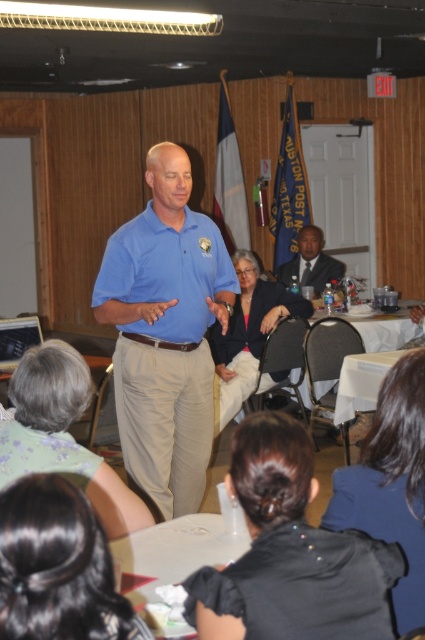
Which of these two, matte blue shirt at center or dark gray suit at center, stands shorter?

Standing shorter between the two is dark gray suit at center.

Does matte blue shirt at center have a greater height compared to dark gray suit at center?

Yes.

Identify the location of matte blue shirt at center. Image resolution: width=425 pixels, height=640 pixels. (166, 333).

Does matte blue shirt at center have a lesser width compared to white plastic table at lower center?

No, matte blue shirt at center is not thinner than white plastic table at lower center.

Is matte blue shirt at center in front of white plastic table at lower center?

No.

Where is `matte blue shirt at center`? matte blue shirt at center is located at coordinates (166, 333).

Measure the distance between white plastic table at lower center and dark gray suit at center.

They are 15.45 feet apart.

Which is below, white plastic table at lower center or dark gray suit at center?

white plastic table at lower center is below.

Find the location of a particular element. This screenshot has height=640, width=425. white plastic table at lower center is located at coordinates tap(173, 557).

Locate an element on the screen. This screenshot has height=640, width=425. white plastic table at lower center is located at coordinates (173, 557).